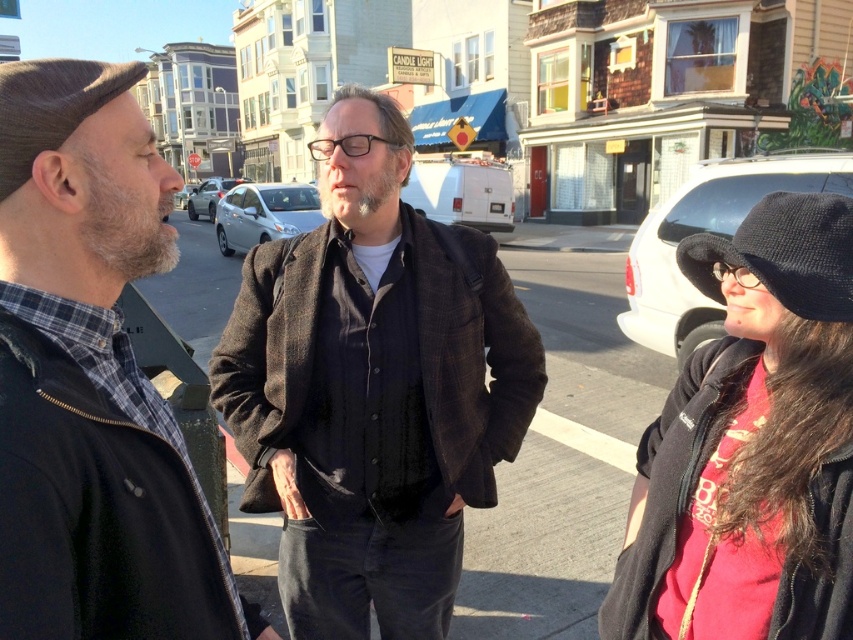
Can you confirm if dark brown woolen jacket at center is taller than dark brown leather hat at left?

Indeed, dark brown woolen jacket at center has a greater height compared to dark brown leather hat at left.

Can you confirm if dark brown woolen jacket at center is smaller than dark brown leather hat at left?

No.

At what (x,y) coordinates should I click in order to perform the action: click on dark brown woolen jacket at center. Please return your answer as a coordinate pair (x, y). This screenshot has height=640, width=853. Looking at the image, I should click on (373, 387).

Identify the location of dark brown woolen jacket at center. The image size is (853, 640). (373, 387).

Describe the element at coordinates (373, 387) in the screenshot. The width and height of the screenshot is (853, 640). I see `dark brown woolen jacket at center` at that location.

Based on the photo, is dark brown woolen jacket at center above knit black hat at right?

Yes, dark brown woolen jacket at center is above knit black hat at right.

Who is more distant from viewer, (395, 298) or (700, 236)?

Positioned behind is point (395, 298).

Where is `dark brown woolen jacket at center`? dark brown woolen jacket at center is located at coordinates (373, 387).

Based on the photo, can you confirm if plaid fabric shirt at left is wider than dark brown leather hat at left?

Yes.

Between plaid fabric shirt at left and dark brown leather hat at left, which one has less height?

dark brown leather hat at left

Measure the distance between plaid fabric shirt at left and camera.

plaid fabric shirt at left and camera are 29.40 inches apart.

Locate an element on the screen. This screenshot has height=640, width=853. plaid fabric shirt at left is located at coordinates (91, 378).